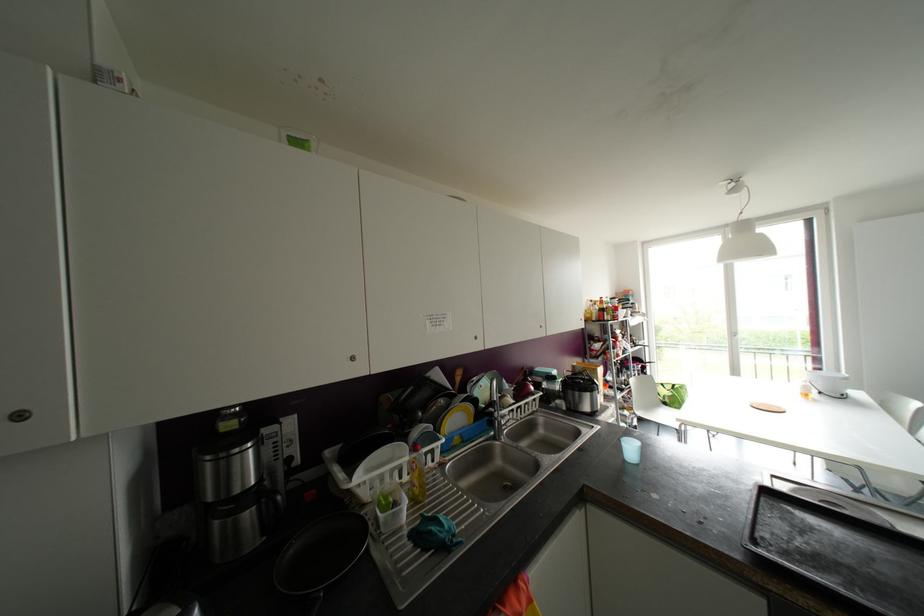
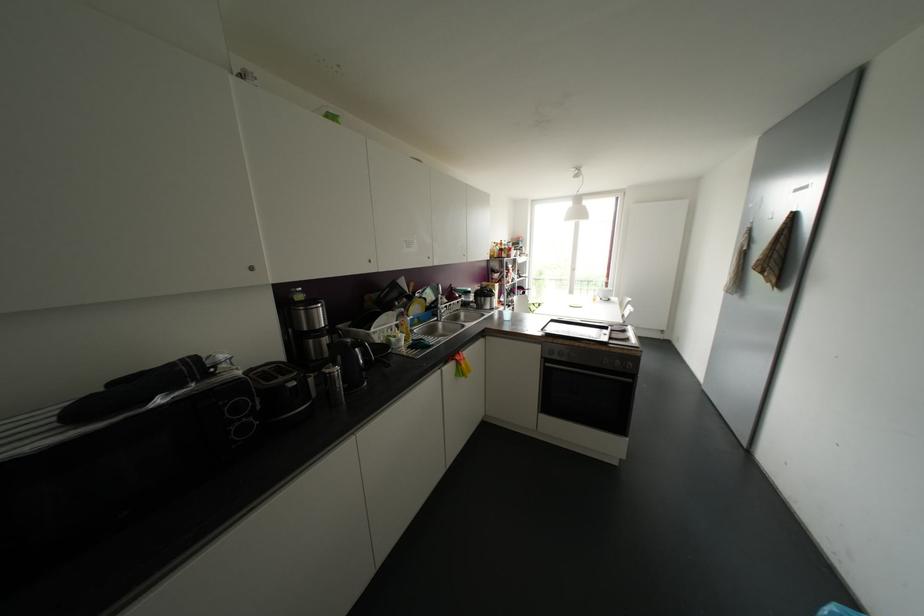
Where in the second image is the point corresponding to [456,418] from the first image?

(416, 307)